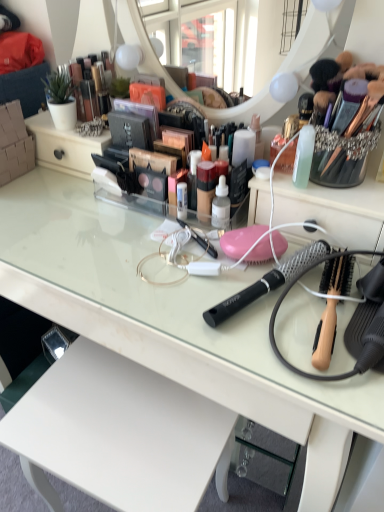
This screenshot has height=512, width=384. In order to click on vacant area situated to the left side of black mesh hairbrush at center, which appears as the second brush when viewed from the right in this screenshot , I will do `click(166, 277)`.